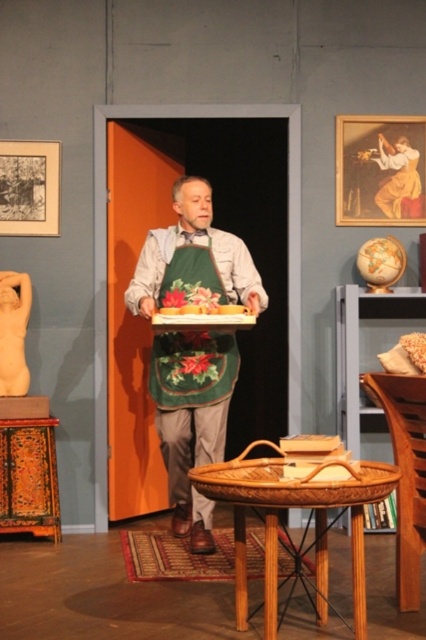
Can you confirm if green felt apron at center is bigger than matte beige sculpture at left?

Indeed, green felt apron at center has a larger size compared to matte beige sculpture at left.

Can you confirm if green felt apron at center is shorter than matte beige sculpture at left?

In fact, green felt apron at center may be taller than matte beige sculpture at left.

This screenshot has width=426, height=640. What are the coordinates of `green felt apron at center` in the screenshot? It's located at (192, 419).

The width and height of the screenshot is (426, 640). Find the location of `green felt apron at center`. green felt apron at center is located at coordinates (192, 419).

Is woven wood chair at lower right wider than matte beige sculpture at left?

Yes.

Who is more forward, (391, 444) or (14, 352)?

Positioned in front is point (391, 444).

In order to click on woven wood chair at lower right in this screenshot , I will do `click(405, 474)`.

Between woven wood table at center and matte beige sculpture at left, which one is positioned higher?

Positioned higher is matte beige sculpture at left.

Based on the photo, who is more distant from viewer, (327, 465) or (11, 328)?

The point (11, 328) is more distant.

Does point (287, 500) come behind point (11, 337)?

No, (287, 500) is closer to viewer.

Image resolution: width=426 pixels, height=640 pixels. I want to click on woven wood table at center, so tap(285, 529).